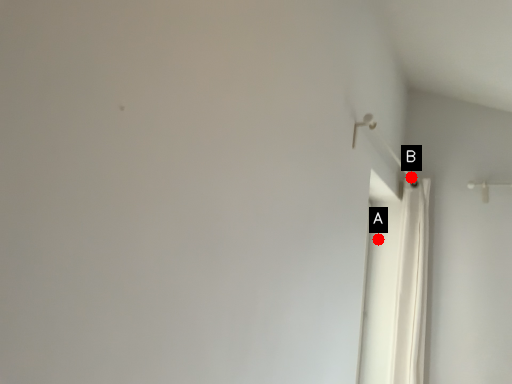
Question: Two points are circled on the image, labeled by A and B beside each circle. Which point is farther to the camera?

Choices:
 (A) A is further
 (B) B is further

Answer: (A)